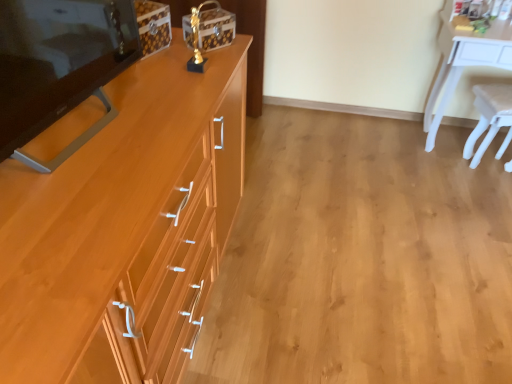
Where is `free space to the left of white glossy desk at upper right`? This screenshot has width=512, height=384. free space to the left of white glossy desk at upper right is located at coordinates (384, 150).